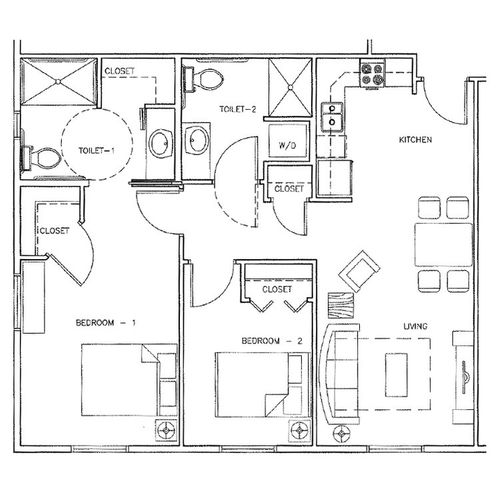
Find the location of a particular element. The height and width of the screenshot is (500, 500). bedroom area is located at coordinates (107, 248), (157, 310), (47, 383), (82, 428).